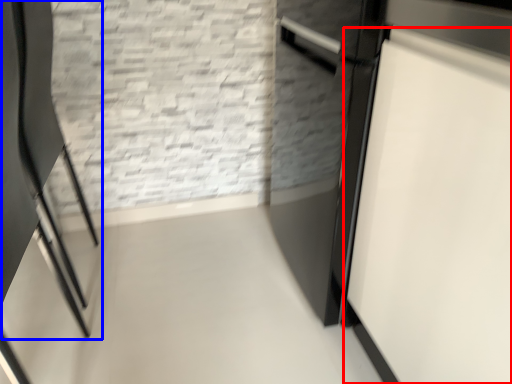
Question: Which object appears farthest to the camera in this image, door (highlighted by a red box) or chair (highlighted by a blue box)?

Choices:
 (A) door
 (B) chair

Answer: (B)